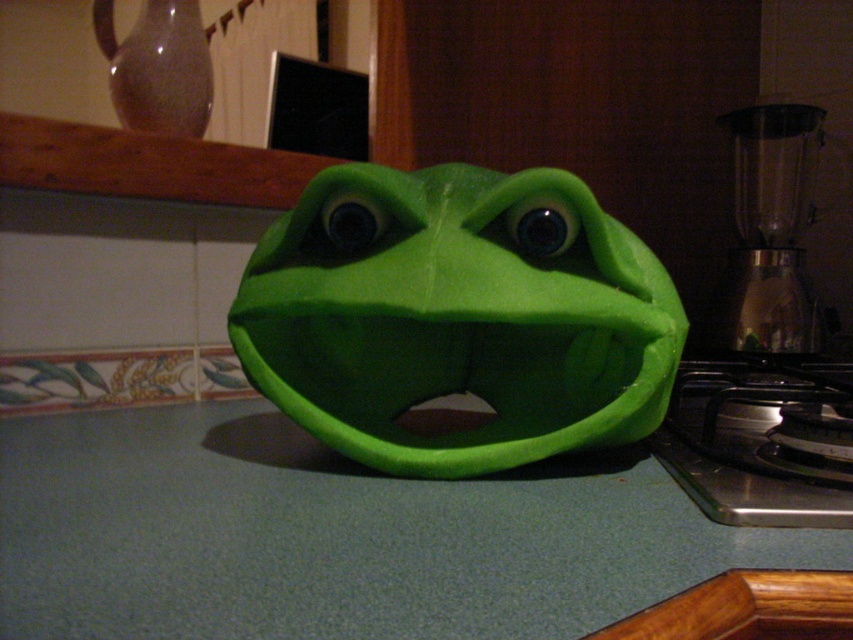
You are trying to determine if the green matte mask at center and the transparent glass blender at right can both fit on a shelf that can only hold items up to the size of the blender. Based on their sizes, will both items fit?

The green matte mask at center is smaller than the transparent glass blender at right, so both items can fit on the shelf since the mask is smaller and the blender matches the maximum size allowed.

You are organizing items on the kitchen counter and need to place a new spice jar. The green matte counter top at center and the green matte mask at center are both in your view. Which surface has enough space for the spice jar?

The green matte mask at center has a larger size compared to the green matte counter top at center, so it might have more space to place the spice jar.

You are trying to place a new decorative item on the green matte counter top at center. The item is as wide as the green matte mask at center. Will it fit entirely on the counter top without hanging over the edges?

The green matte counter top at center is wider than the green matte mask at center, so the new item, which is as wide as the mask, will fit entirely on the counter top without hanging over the edges.